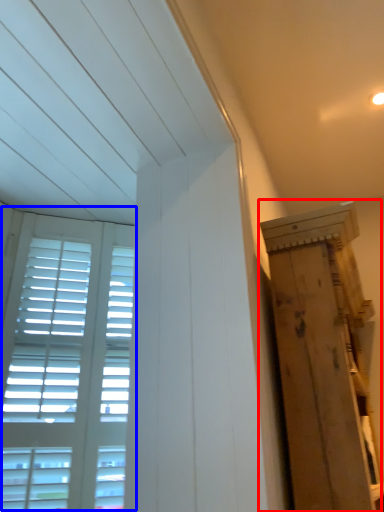
Question: Which object is closer to the camera taking this photo, plywood (highlighted by a red box) or window (highlighted by a blue box)?

Choices:
 (A) plywood
 (B) window

Answer: (A)